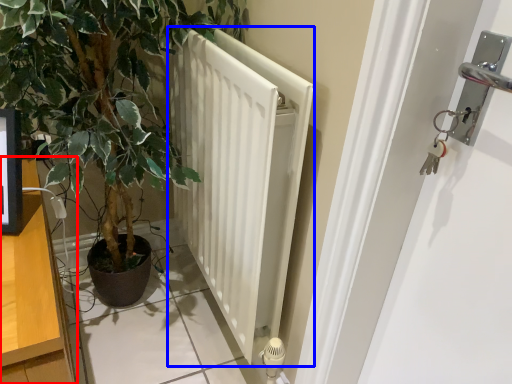
Question: Which object is closer to the camera taking this photo, dresser (highlighted by a red box) or radiator (highlighted by a blue box)?

Choices:
 (A) dresser
 (B) radiator

Answer: (A)